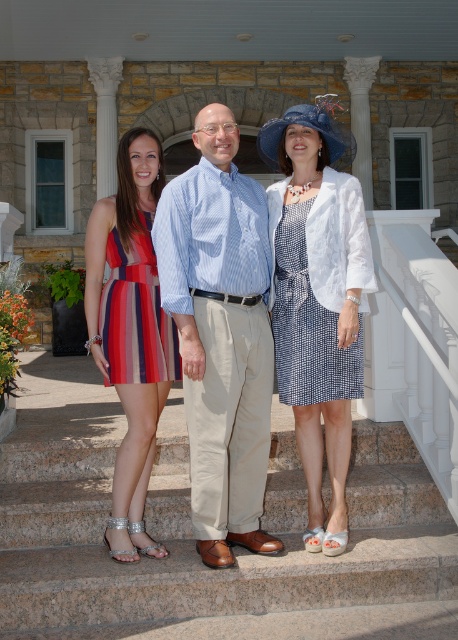
Question: Is matte blue dress at center below blue striped shirt at center?

Choices:
 (A) no
 (B) yes

Answer: (A)

Question: Which object is closer to the camera taking this photo?

Choices:
 (A) blue striped shirt at center
 (B) blue houndstooth dress at center
 (C) striped cotton dress at left

Answer: (A)

Question: Which of the following is the closest to the observer?

Choices:
 (A) click(235, 269)
 (B) click(88, 564)
 (C) click(282, 269)

Answer: (B)

Question: Where is matte blue dress at center located in relation to blue striped shirt at center in the image?

Choices:
 (A) left
 (B) right

Answer: (A)

Question: Which point is farther from the camera taking this photo?

Choices:
 (A) (316, 147)
 (B) (412, 516)
 (C) (130, 147)

Answer: (B)

Question: Does smooth stone stairs at center have a lesser width compared to blue striped shirt at center?

Choices:
 (A) yes
 (B) no

Answer: (B)